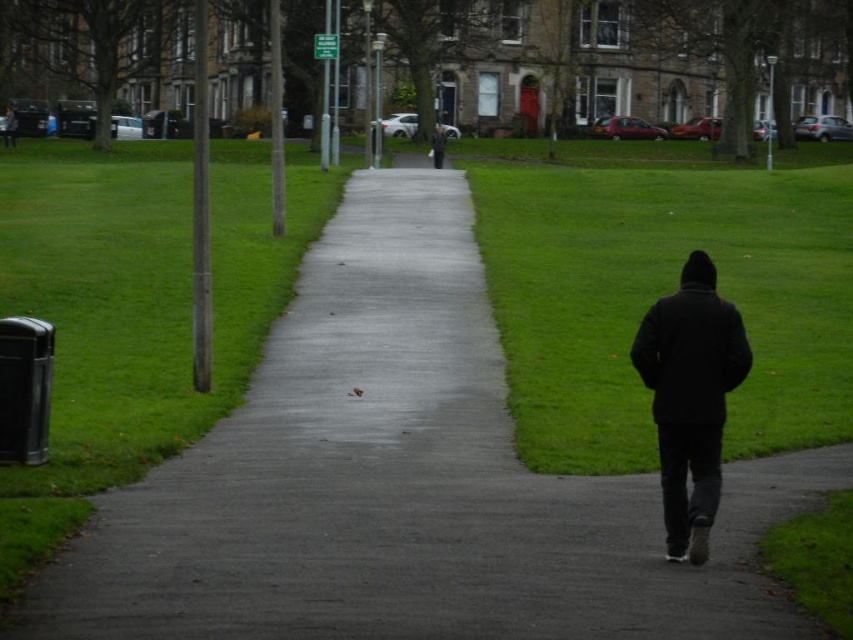
Between concrete at center and black matte jacket at lower right, which one appears on the right side from the viewer's perspective?

Positioned to the right is black matte jacket at lower right.

Can you confirm if concrete at center is wider than black matte jacket at lower right?

Yes.

Looking at this image, measure the distance between point (279,614) and camera.

They are 7.13 meters apart.

Locate an element on the screen. Image resolution: width=853 pixels, height=640 pixels. concrete at center is located at coordinates (404, 483).

Which is above, green grass at left or black matte jacket at lower right?

green grass at left

Between point (213, 381) and point (631, 349), which one is positioned behind?

Positioned behind is point (213, 381).

This screenshot has width=853, height=640. I want to click on green grass at left, so click(136, 307).

Can you confirm if concrete at center is bigger than black matte jacket at center?

Indeed, concrete at center has a larger size compared to black matte jacket at center.

Can you confirm if concrete at center is positioned to the right of black matte jacket at center?

In fact, concrete at center is to the left of black matte jacket at center.

Is point (265, 356) farther from viewer compared to point (444, 140)?

No, it is not.

This screenshot has height=640, width=853. Find the location of `concrete at center`. concrete at center is located at coordinates (404, 483).